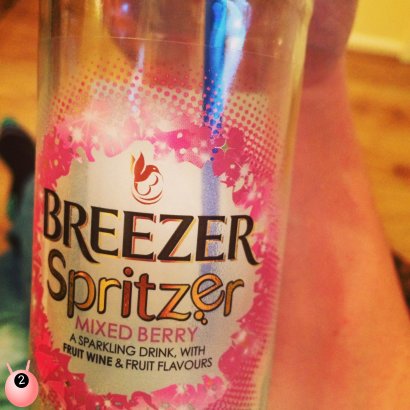
Where is `glass bottle`? glass bottle is located at coordinates (275, 64).